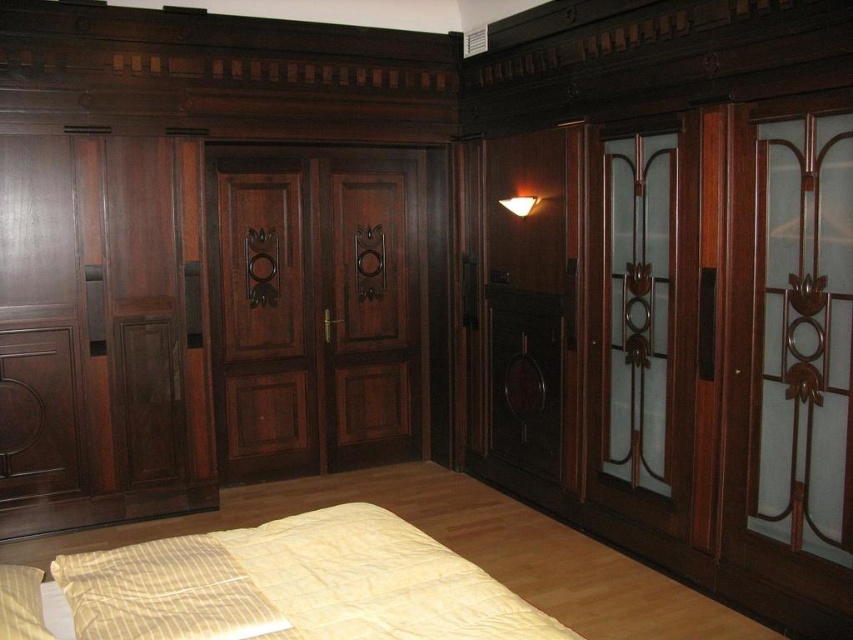
You are a delivery person carrying a package that is 6 feet long. You need to move it through the space between the matte dark wood door at center and the mahogany wood door at right. Can the package fit through the space between them?

The distance between the matte dark wood door at center and the mahogany wood door at right is 6.33 feet. Since the package is 6 feet long, it can fit through the space between them as there is enough clearance.

You are arranging flowers in this room and want to place a vase between the yellow striped pillow at lower left and the matte white wall sconce at upper center. Based on their positions, where should you place the vase?

The vase should be placed between the yellow striped pillow at lower left and the matte white wall sconce at upper center since the pillow is positioned under the sconce.